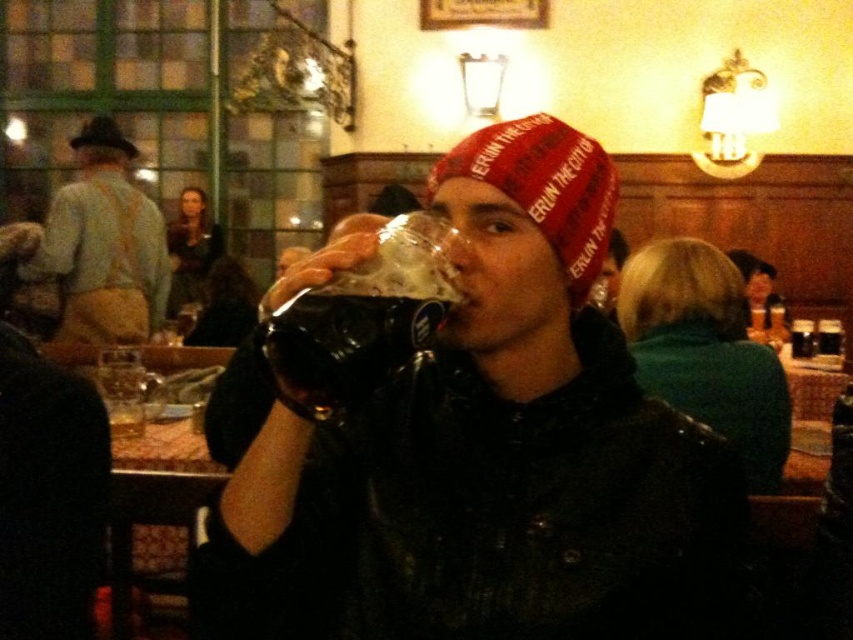
Question: Can you confirm if matte black jacket at center is positioned above translucent glass beer at center?

Choices:
 (A) no
 (B) yes

Answer: (A)

Question: Among these objects, which one is nearest to the camera?

Choices:
 (A) matte black jacket at center
 (B) translucent glass beer at center

Answer: (B)

Question: Does translucent glass beer at center have a lesser width compared to black felt hat at upper left?

Choices:
 (A) yes
 (B) no

Answer: (A)

Question: Based on their relative distances, which object is farther from the black felt hat at upper left?

Choices:
 (A) light brown leather jacket at upper left
 (B) matte black jacket at center
 (C) translucent glass beer at center

Answer: (C)

Question: Does matte black jacket at center appear under light brown leather jacket at upper left?

Choices:
 (A) yes
 (B) no

Answer: (A)

Question: Among these points, which one is farthest from the camera?

Choices:
 (A) (x=302, y=323)
 (B) (x=479, y=500)
 (C) (x=84, y=132)
 (D) (x=82, y=132)

Answer: (D)